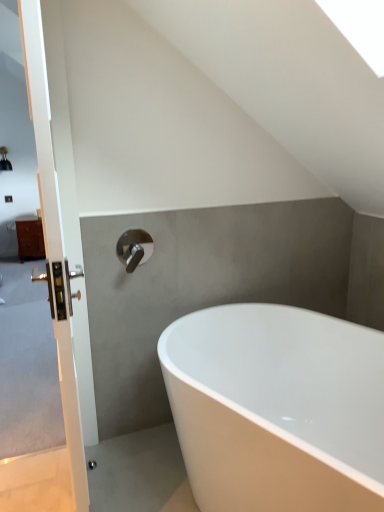
Locate an element on the screen. The image size is (384, 512). satin nickel faucet at upper center is located at coordinates (134, 248).

The width and height of the screenshot is (384, 512). I want to click on tap lying on the left of white glossy bathtub at center, so click(x=134, y=248).

How much distance is there between white glossy bathtub at center and satin nickel faucet at upper center?

The distance of white glossy bathtub at center from satin nickel faucet at upper center is 29.09 inches.

Considering the positions of objects white glossy bathtub at center and satin nickel faucet at upper center in the image provided, who is more to the right, white glossy bathtub at center or satin nickel faucet at upper center?

white glossy bathtub at center is more to the right.

Who is taller, white glossy bathtub at center or satin nickel faucet at upper center?

white glossy bathtub at center.

From a real-world perspective, which object rests below the other?

white glossy bathtub at center is physically lower.

Looking at their sizes, would you say satin nickel faucet at upper center is wider or thinner than white glossy bathtub at center?

Clearly, satin nickel faucet at upper center has less width compared to white glossy bathtub at center.

You are a GUI agent. You are given a task and a screenshot of the screen. Output one action in this format:
    pyautogui.click(x=<x>, y=<y>)
    Task: Click on the bathtub in front of the satin nickel faucet at upper center
    The width and height of the screenshot is (384, 512).
    Given the screenshot: What is the action you would take?
    pyautogui.click(x=277, y=408)

Is point (55, 234) in front of point (140, 245)?

That is True.

Who is taller, white glossy door handle at left or satin nickel faucet at upper center?

white glossy door handle at left.

How different are the orientations of white glossy door handle at left and satin nickel faucet at upper center in degrees?

There is a 90.9-degree angle between the facing directions of white glossy door handle at left and satin nickel faucet at upper center.

Where is `screen door above the white glossy bathtub at center (from the image's perspective)`? The image size is (384, 512). screen door above the white glossy bathtub at center (from the image's perspective) is located at coordinates (53, 320).

Does point (69, 498) lie in front of point (265, 379)?

Yes, it is.

Is white glossy door handle at left spatially inside white glossy bathtub at center, or outside of it?

white glossy door handle at left is spatially situated outside white glossy bathtub at center.

Is white glossy door handle at left directly adjacent to white glossy bathtub at center?

No, white glossy door handle at left is not touching white glossy bathtub at center.

From the image's perspective, is white glossy bathtub at center above or below white glossy door handle at left?

From the image's perspective, white glossy bathtub at center appears below white glossy door handle at left.

Considering the sizes of objects white glossy bathtub at center and white glossy door handle at left in the image provided, who is wider, white glossy bathtub at center or white glossy door handle at left?

With larger width is white glossy bathtub at center.

Does white glossy bathtub at center appear on the left side of white glossy door handle at left?

No, white glossy bathtub at center is not to the left of white glossy door handle at left.

From a real-world perspective, does white glossy bathtub at center stand above white glossy door handle at left?

No, from a real-world perspective, white glossy bathtub at center is not on top of white glossy door handle at left.

Choose the correct answer: Is satin nickel faucet at upper center inside white glossy door handle at left or outside it?

satin nickel faucet at upper center is not enclosed by white glossy door handle at left.

Which object is closer to the camera, satin nickel faucet at upper center or white glossy door handle at left?

white glossy door handle at left.

This screenshot has height=512, width=384. In order to click on tap that is under the white glossy door handle at left (from a real-world perspective) in this screenshot , I will do `click(134, 248)`.

Between point (139, 242) and point (33, 19), which one is positioned behind?

The point (139, 242) is more distant.

Find the location of `bathtub that is below the satin nickel faucet at upper center (from the image's perspective)`. bathtub that is below the satin nickel faucet at upper center (from the image's perspective) is located at coordinates (277, 408).

At what (x,y) coordinates should I click in order to perform the action: click on tap to the left of white glossy bathtub at center. Please return your answer as a coordinate pair (x, y). Looking at the image, I should click on (134, 248).

Which object lies further to the anchor point satin nickel faucet at upper center, white glossy door handle at left or white glossy bathtub at center?

white glossy bathtub at center lies further to satin nickel faucet at upper center than the other object.

Estimate the real-world distances between objects in this image. Which object is further from white glossy door handle at left, white glossy bathtub at center or satin nickel faucet at upper center?

white glossy bathtub at center lies further to white glossy door handle at left than the other object.

Based on their spatial positions, is satin nickel faucet at upper center or white glossy bathtub at center further from white glossy door handle at left?

white glossy bathtub at center is positioned further to the anchor white glossy door handle at left.

Based on their spatial positions, is white glossy bathtub at center or white glossy door handle at left closer to satin nickel faucet at upper center?

Based on the image, white glossy door handle at left appears to be nearer to satin nickel faucet at upper center.

Based on their spatial positions, is satin nickel faucet at upper center or white glossy door handle at left closer to white glossy bathtub at center?

satin nickel faucet at upper center.

Looking at the image, which one is located further to white glossy bathtub at center, white glossy door handle at left or satin nickel faucet at upper center?

white glossy door handle at left is positioned further to the anchor white glossy bathtub at center.

The width and height of the screenshot is (384, 512). I want to click on bathtub positioned between white glossy door handle at left and satin nickel faucet at upper center from near to far, so click(x=277, y=408).